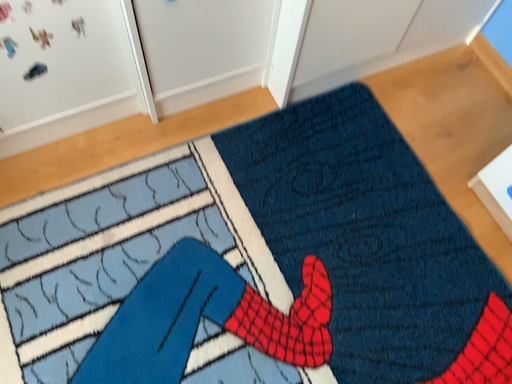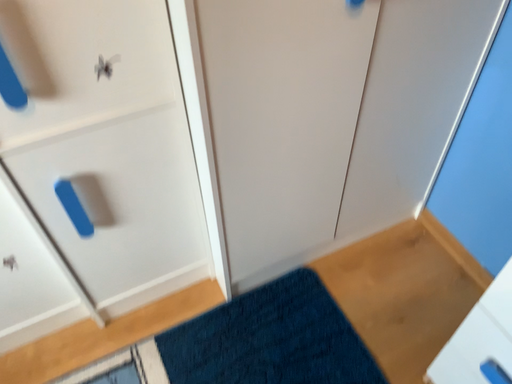
Question: Which way did the camera rotate in the video?

Choices:
 (A) rotated upward
 (B) rotated downward

Answer: (A)